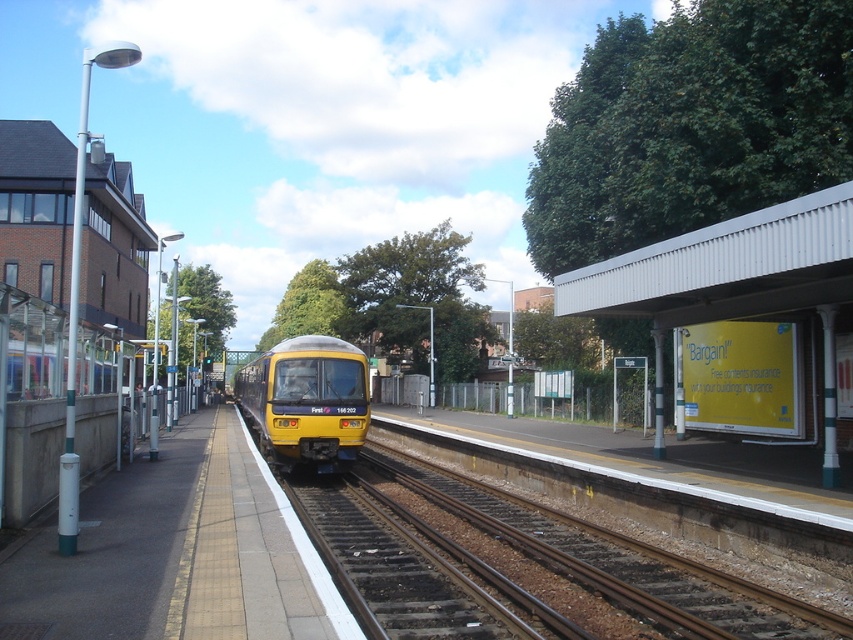
Is the position of brown metal track at center more distant than that of yellow matte train at center?

No, it is in front of yellow matte train at center.

Does brown metal track at center have a lesser width compared to yellow matte train at center?

Yes.

Is point (744, 621) farther from camera compared to point (347, 408)?

No, (744, 621) is in front of (347, 408).

Where is `brown metal track at center`? The image size is (853, 640). brown metal track at center is located at coordinates (611, 560).

Is smooth concrete platform at center below brown metal track at center?

No.

Which is in front, point (120, 595) or point (531, 500)?

Positioned in front is point (120, 595).

This screenshot has width=853, height=640. Identify the location of smooth concrete platform at center. (177, 554).

Consider the image. Who is shorter, smooth concrete platform at center or yellow matte train at center?

Standing shorter between the two is smooth concrete platform at center.

Looking at this image, is smooth concrete platform at center above yellow matte train at center?

Yes.

Image resolution: width=853 pixels, height=640 pixels. What do you see at coordinates (177, 554) in the screenshot?
I see `smooth concrete platform at center` at bounding box center [177, 554].

This screenshot has height=640, width=853. I want to click on smooth concrete platform at center, so click(177, 554).